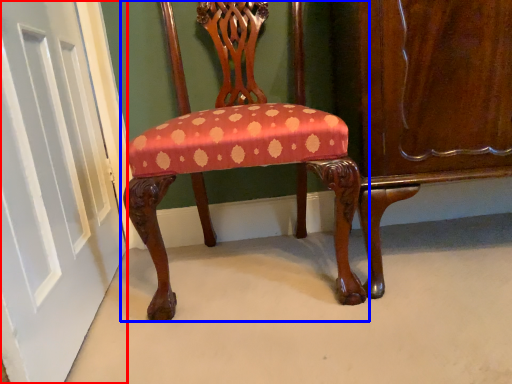
Question: Which object appears farthest to the camera in this image, door (highlighted by a red box) or chair (highlighted by a blue box)?

Choices:
 (A) door
 (B) chair

Answer: (B)